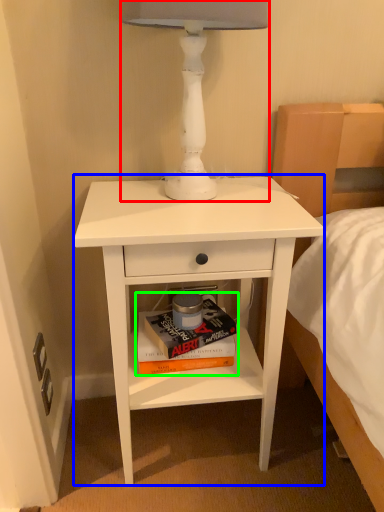
Question: Estimate the real-world distances between objects in this image. Which object is closer to table lamp (highlighted by a red box), nightstand (highlighted by a blue box) or paperback book (highlighted by a green box)?

Choices:
 (A) nightstand
 (B) paperback book

Answer: (A)